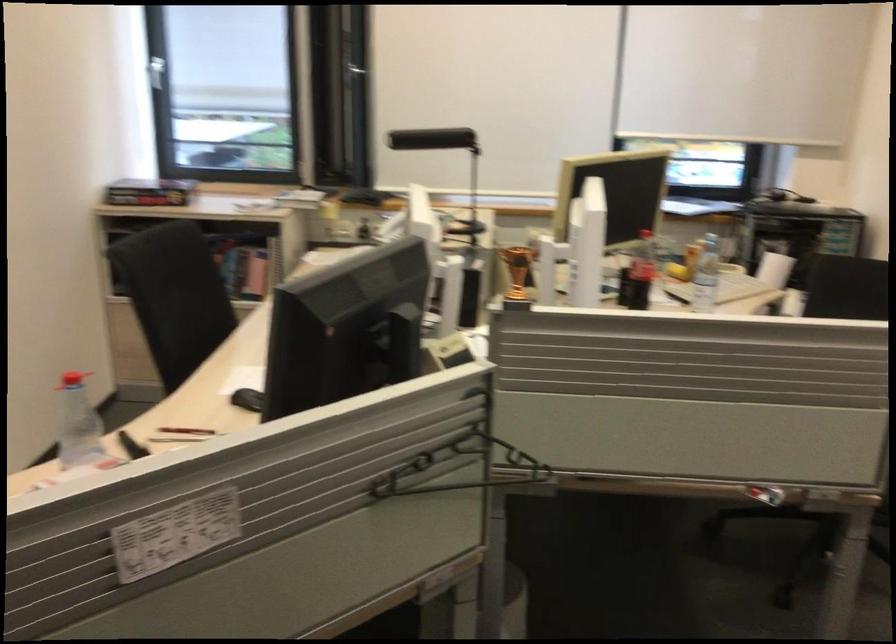
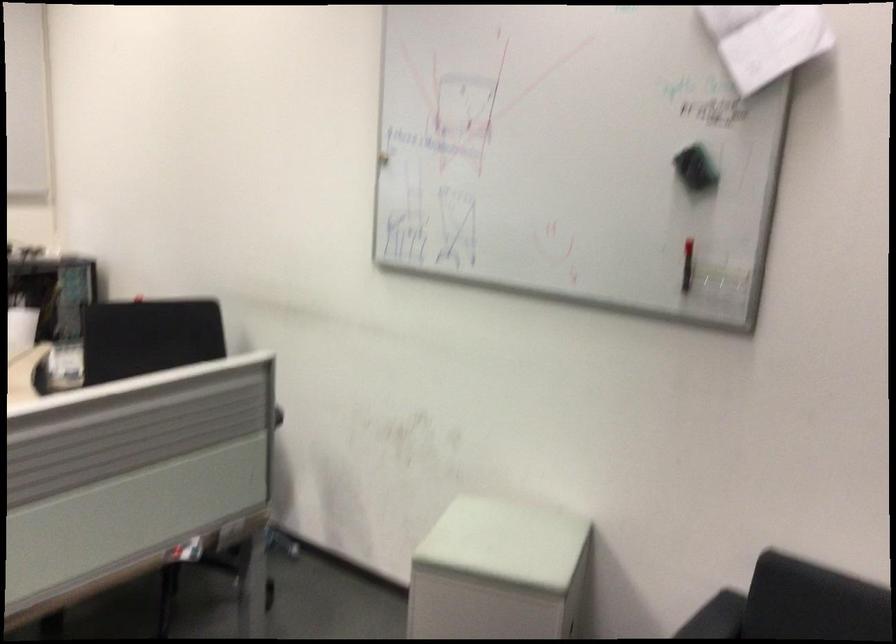
Question: How did the camera likely rotate?

Choices:
 (A) Left
 (B) Right
 (C) Up
 (D) Down

Answer: (B)